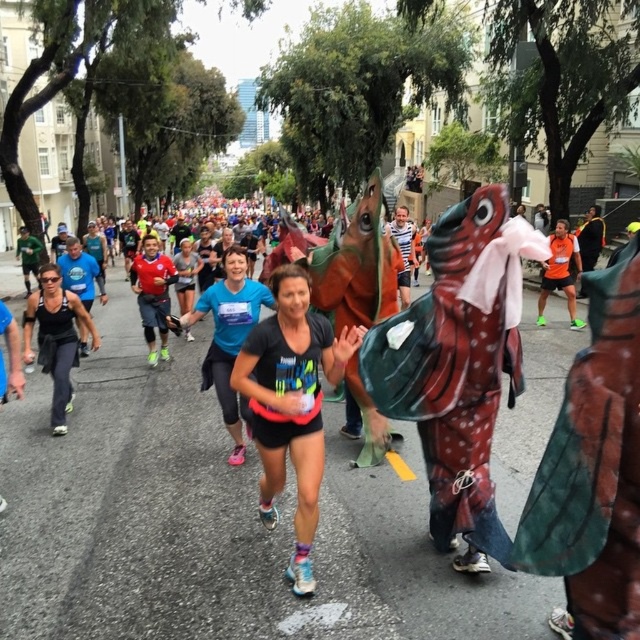
Does black matte t-shirt at center have a lesser width compared to matte black tank top at left?

No.

Between black matte t-shirt at center and matte black tank top at left, which one is positioned higher?

matte black tank top at left is above.

Is point (248, 340) positioned behind point (61, 378)?

No, (248, 340) is closer to viewer.

The width and height of the screenshot is (640, 640). Identify the location of black matte t-shirt at center. (291, 404).

Measure the distance from black matte t-shirt at center to blue fabric shirt at center.

They are 89.04 centimeters apart.

Does black matte t-shirt at center have a larger size compared to blue fabric shirt at center?

Actually, black matte t-shirt at center might be smaller than blue fabric shirt at center.

Which is in front, point (273, 493) or point (220, 348)?

Point (273, 493)

Locate an element on the screen. The image size is (640, 640). black matte t-shirt at center is located at coordinates (291, 404).

Does blue fabric shirt at center have a smaller size compared to matte black tank top at left?

Actually, blue fabric shirt at center might be larger than matte black tank top at left.

Who is more forward, (225, 317) or (65, 298)?

Point (225, 317)

At what (x,y) coordinates should I click in order to perform the action: click on blue fabric shirt at center. Please return your answer as a coordinate pair (x, y). The height and width of the screenshot is (640, 640). Looking at the image, I should click on (228, 337).